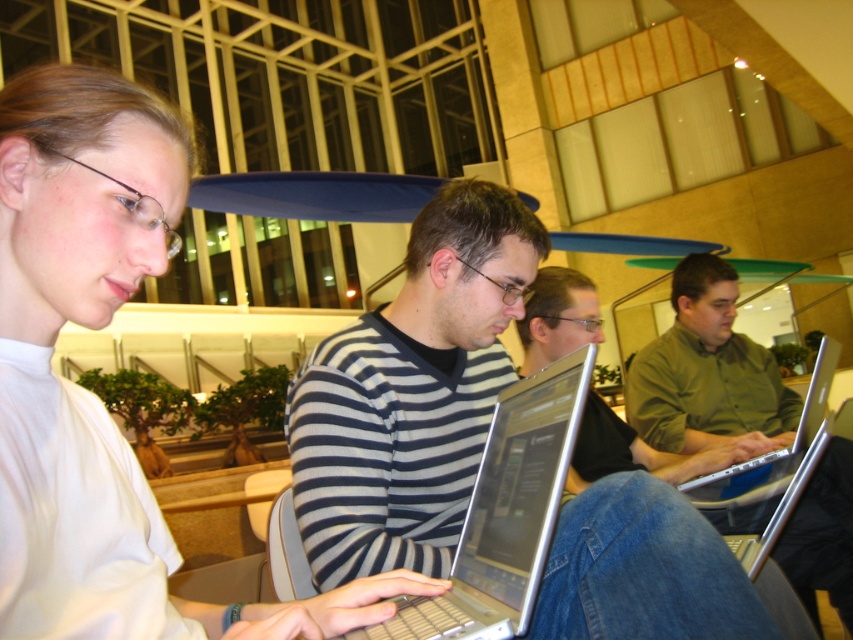
You are standing in the room and want to hand a document to the person wearing the striped sweater at center without disturbing the person using the silver metallic laptop at right. Which direction should you approach from?

You should approach from the left side of the striped sweater at center because it is closer to the viewer than the silver metallic laptop at right, so moving from the left would avoid blocking the laptop user.

You are an interior designer observing this modern workspace. You need to determine the spatial relationship between the striped sweater at center and the silver metallic laptop at right. Based on the scene, which object is positioned higher relative to the other?

The striped sweater at center is positioned above the silver metallic laptop at right, meaning it is higher in placement.